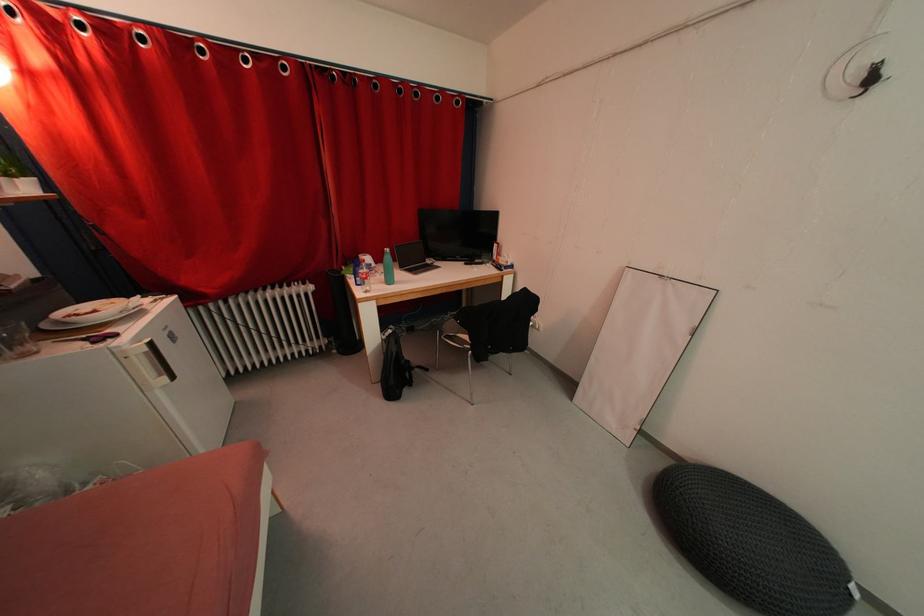
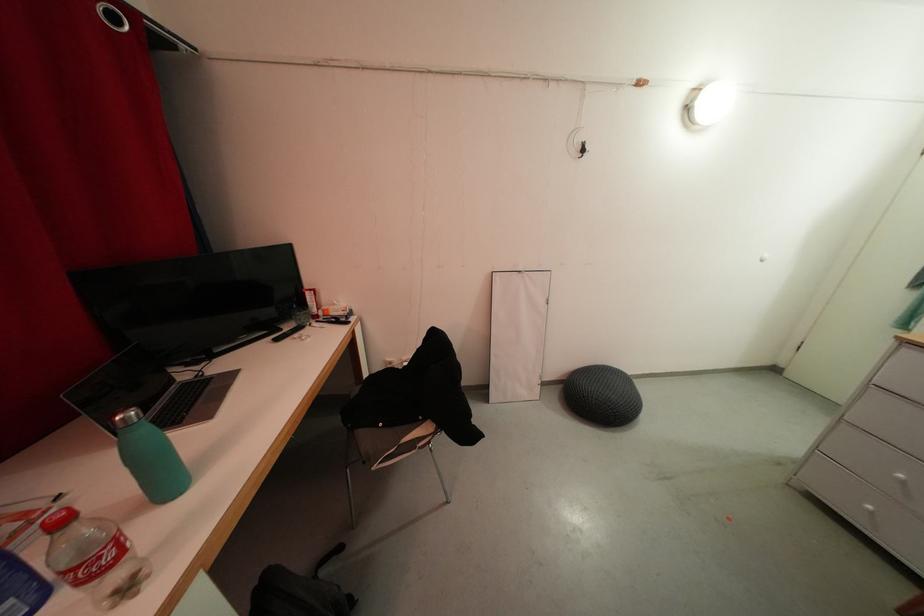
In the second image, find the point that corresponds to [532,306] in the first image.

(441, 345)